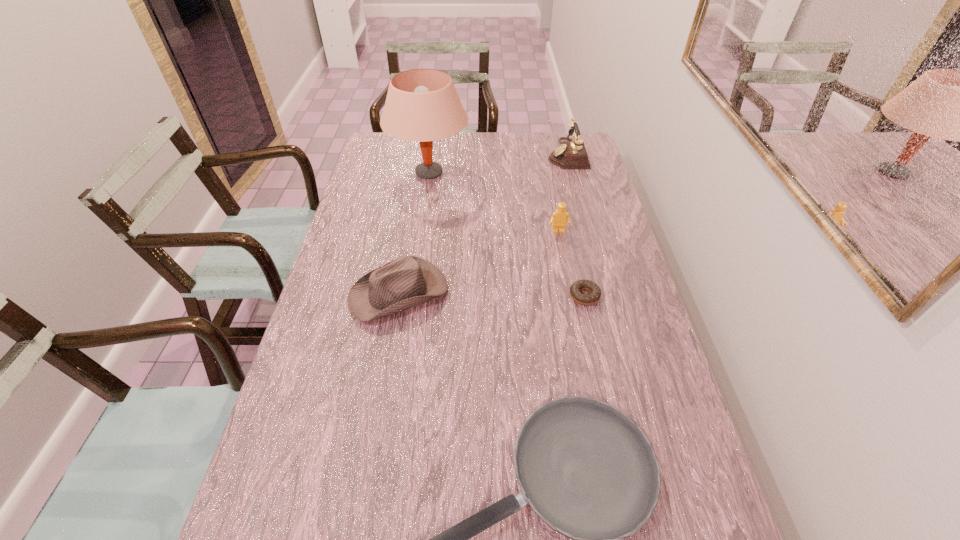
Where is `lampshade`? lampshade is located at coordinates (422, 105).

Locate an element on the screen. The width and height of the screenshot is (960, 540). the fifth shortest object is located at coordinates (571, 154).

This screenshot has height=540, width=960. What are the coordinates of `Lego` in the screenshot? It's located at (559, 218).

Locate an element on the screen. The width and height of the screenshot is (960, 540). fedora is located at coordinates (408, 281).

Image resolution: width=960 pixels, height=540 pixels. In order to click on the shortest object in this screenshot , I will do `click(595, 293)`.

You are a GUI agent. You are given a task and a screenshot of the screen. Output one action in this format:
    pyautogui.click(x=<x>, y=<y>)
    Task: Click on the vacant region located 0.110m on the front-facing side of the lampshade
    This screenshot has width=960, height=540.
    Given the screenshot: What is the action you would take?
    pyautogui.click(x=498, y=172)

Where is `free region located 0.220m on the dial of the telephone`? free region located 0.220m on the dial of the telephone is located at coordinates (492, 154).

The height and width of the screenshot is (540, 960). Find the location of `vacant area situated on the dial of the telephone`. vacant area situated on the dial of the telephone is located at coordinates (497, 154).

The width and height of the screenshot is (960, 540). I want to click on free space located 0.360m on the dial of the telephone, so click(x=458, y=154).

Locate an element on the screen. The width and height of the screenshot is (960, 540). vacant area situated on the face of the Lego is located at coordinates (565, 268).